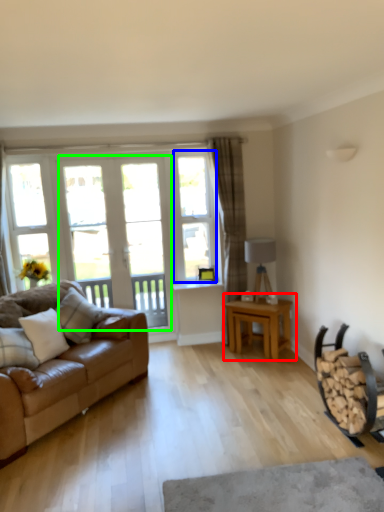
Question: Estimate the real-world distances between objects in this image. Which object is farther from table (highlighted by a red box), window (highlighted by a blue box) or screen door (highlighted by a green box)?

Choices:
 (A) window
 (B) screen door

Answer: (B)